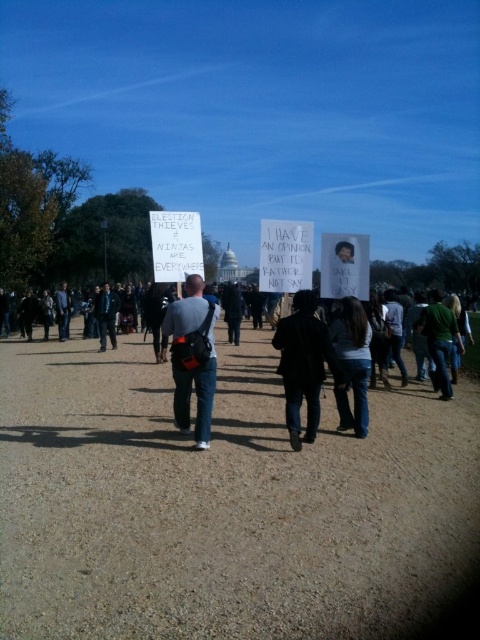
How far apart are dark gray jeans at center and dark blue shirt at center?

A distance of 7.06 meters exists between dark gray jeans at center and dark blue shirt at center.

Looking at this image, between dark gray jeans at center and dark blue shirt at center, which one is positioned higher?

dark gray jeans at center

Describe the element at coordinates (217, 432) in the screenshot. The height and width of the screenshot is (640, 480). I see `dark gray jeans at center` at that location.

Locate an element on the screen. The width and height of the screenshot is (480, 640). dark gray jeans at center is located at coordinates (217, 432).

Who is lower down, dark gray jeans at center or gray fabric backpack at center?

dark gray jeans at center is lower down.

Between point (180, 422) and point (207, 362), which one is positioned behind?

The point (180, 422) is behind.

Identify the location of dark gray jeans at center. This screenshot has height=640, width=480. (217, 432).

Does brown gravel at center have a larger size compared to dark gray jeans at center?

Actually, brown gravel at center might be smaller than dark gray jeans at center.

Does brown gravel at center have a smaller size compared to dark gray jeans at center?

Yes.

Who is more distant from viewer, [45,465] or [352,461]?

Positioned behind is point [352,461].

I want to click on brown gravel at center, so click(224, 502).